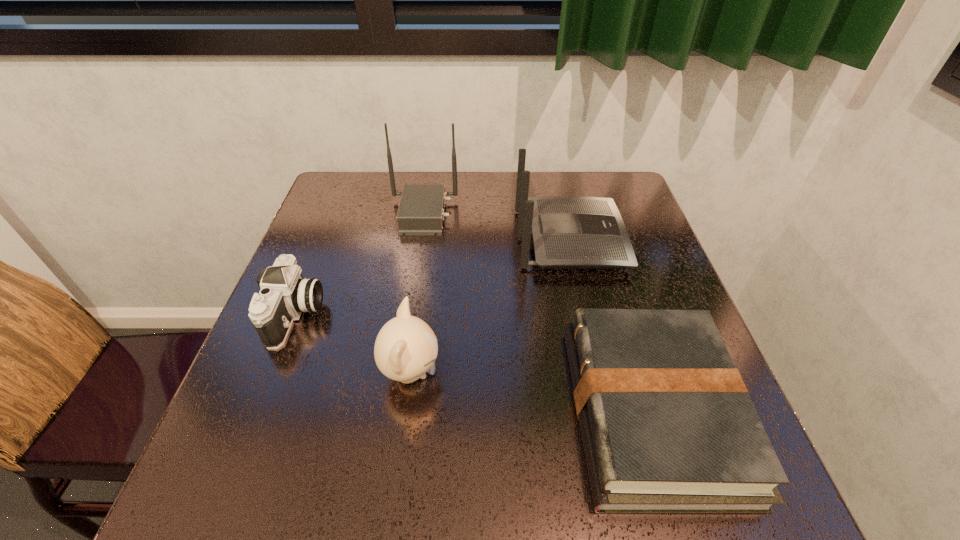
At what (x,y) coordinates should I click in order to perform the action: click on vacant region between the shortest object and the camera. Please return your answer as a coordinate pair (x, y). This screenshot has width=960, height=540. Looking at the image, I should click on (473, 363).

At what (x,y) coordinates should I click in order to perform the action: click on vacant region between the right router and the second shortest object. Please return your answer as a coordinate pair (x, y). This screenshot has width=960, height=540. Looking at the image, I should click on pyautogui.click(x=433, y=277).

The height and width of the screenshot is (540, 960). I want to click on empty space between the third shortest object and the left router, so click(417, 294).

Identify the location of object that is the fourth closest one to the hardback book. This screenshot has height=540, width=960. (285, 294).

Where is `object that is the closest to the right router`? The height and width of the screenshot is (540, 960). object that is the closest to the right router is located at coordinates (421, 210).

Locate an element on the screen. Image resolution: width=960 pixels, height=540 pixels. free space that satisfies the following two spatial constraints: 1. on the back side of the fourth tallest object; 2. on the front-facing side of the right router is located at coordinates (326, 239).